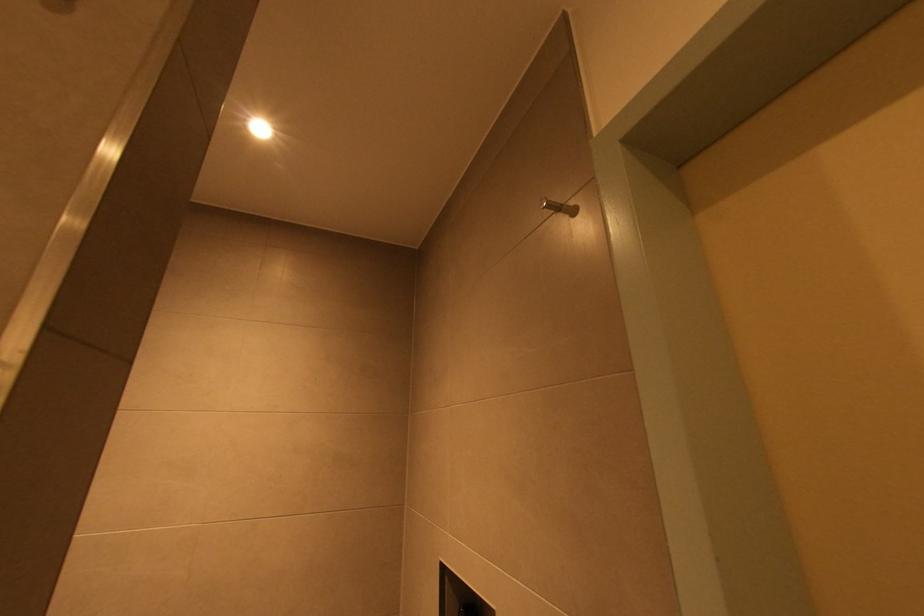
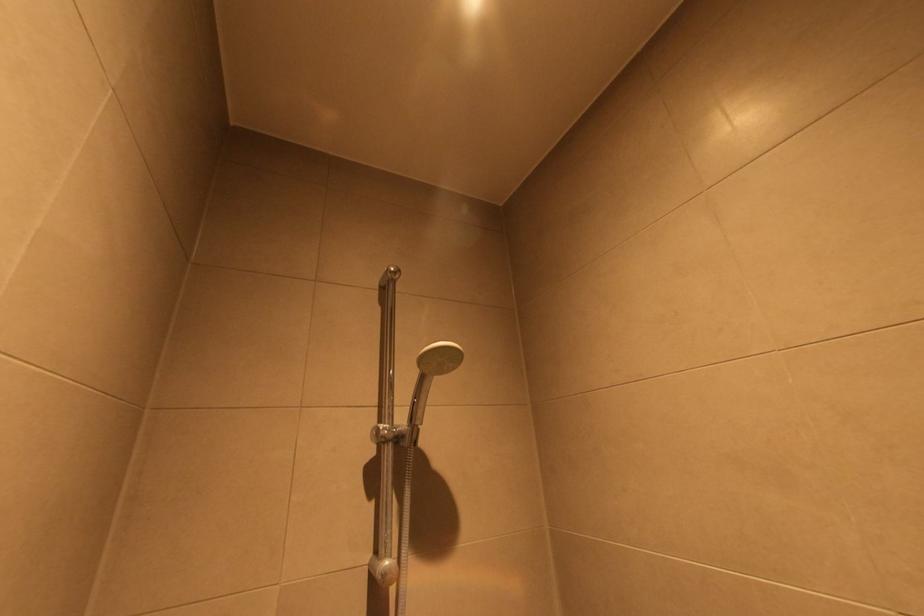
How did the camera likely rotate?

The camera rotated toward left-up.